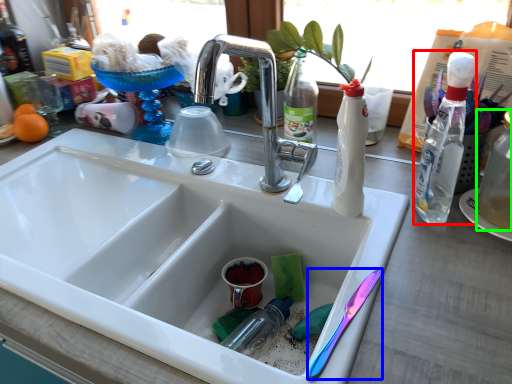
Question: Which object is positioned closest to bottle (highlighted by a red box)? Select from silverware (highlighted by a blue box) and bottle (highlighted by a green box).

Choices:
 (A) silverware
 (B) bottle

Answer: (B)